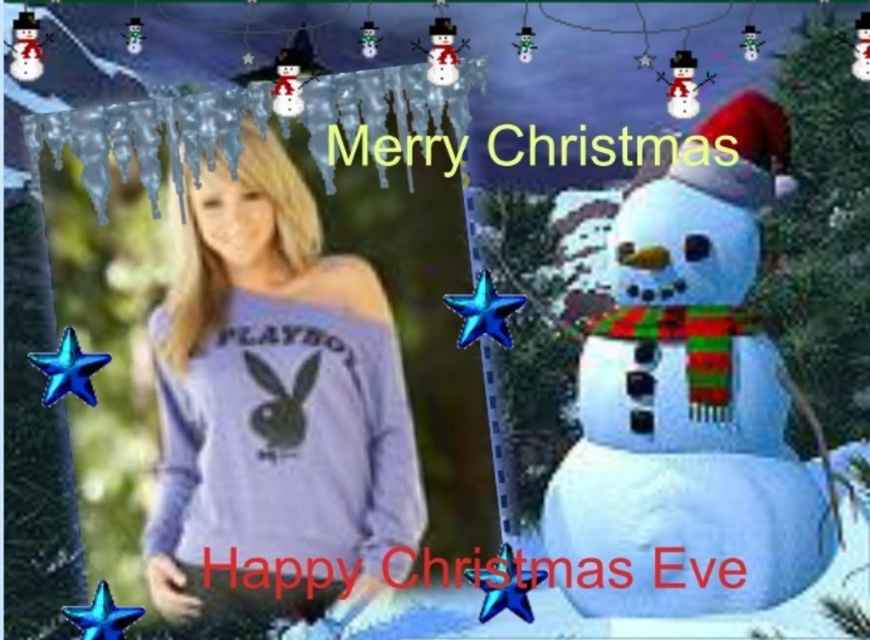
Question: Can you confirm if matte purple sweatshirt at center is smaller than white matte snowman at right?

Choices:
 (A) no
 (B) yes

Answer: (B)

Question: Is matte purple sweatshirt at center wider than white matte snowman at right?

Choices:
 (A) no
 (B) yes

Answer: (A)

Question: Which of the following is the closest to the observer?

Choices:
 (A) (293, 296)
 (B) (566, 508)

Answer: (B)

Question: Does matte purple sweatshirt at center have a larger size compared to white matte snowman at right?

Choices:
 (A) no
 (B) yes

Answer: (A)